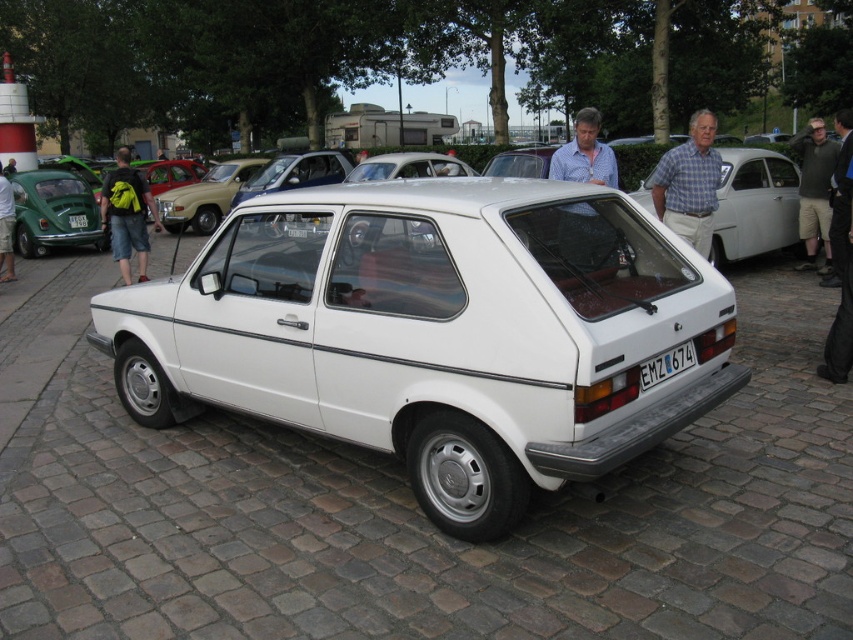
Question: Which of these objects is positioned farthest from the khaki shorts at right?

Choices:
 (A) white plastic license plate at center
 (B) green matte license plate at center
 (C) black leather jacket at right

Answer: (B)

Question: Can you confirm if plaid shirt at center is positioned to the left of khaki shorts at right?

Choices:
 (A) no
 (B) yes

Answer: (B)

Question: Can you confirm if white matte hatchback at center is thinner than plaid shirt at center?

Choices:
 (A) no
 (B) yes

Answer: (A)

Question: Which of the following is the closest to the observer?

Choices:
 (A) (308, 234)
 (B) (828, 179)
 (C) (224, 173)

Answer: (A)

Question: Is black leather jacket at right positioned in front of green backpack at left?

Choices:
 (A) yes
 (B) no

Answer: (A)

Question: Which object appears closest to the camera in this image?

Choices:
 (A) white glossy sedan at center
 (B) matte beige car at center

Answer: (A)